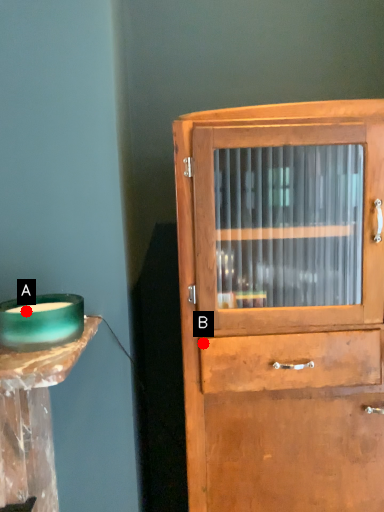
Question: Two points are circled on the image, labeled by A and B beside each circle. Which of the following is the farthest from the observer?

Choices:
 (A) A is further
 (B) B is further

Answer: (B)